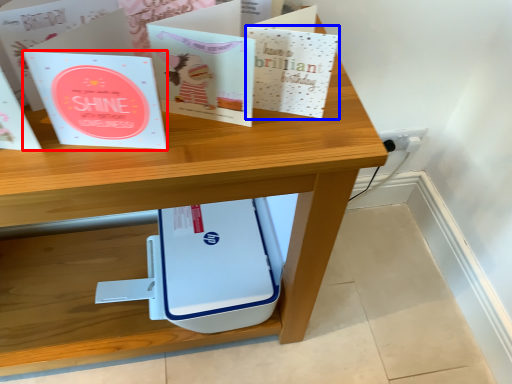
Question: Which object appears closest to the camera in this image, paperback book (highlighted by a red box) or paperback book (highlighted by a blue box)?

Choices:
 (A) paperback book
 (B) paperback book

Answer: (A)